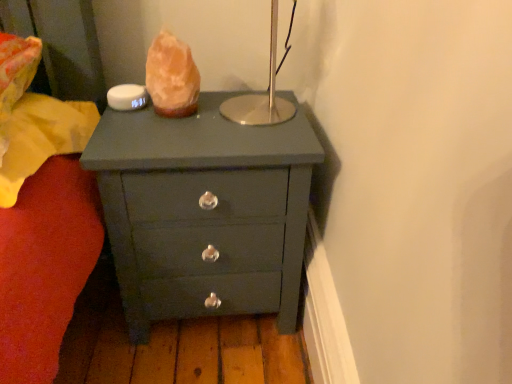
This screenshot has width=512, height=384. I want to click on matte dark green chest of drawers at center, so click(204, 211).

Measure the distance between matte dark green chest of drawers at center and camera.

A distance of 34.17 inches exists between matte dark green chest of drawers at center and camera.

Image resolution: width=512 pixels, height=384 pixels. What do you see at coordinates (204, 211) in the screenshot? I see `matte dark green chest of drawers at center` at bounding box center [204, 211].

Measure the distance between orange crystal at center and camera.

orange crystal at center and camera are 38.68 inches apart from each other.

Measure the distance between point (162, 105) and camera.

3.39 feet.

This screenshot has height=384, width=512. Identify the location of orange crystal at center. (172, 77).

What do you see at coordinates (172, 77) in the screenshot? I see `orange crystal at center` at bounding box center [172, 77].

Where is `matte dark green chest of drawers at center`? This screenshot has height=384, width=512. matte dark green chest of drawers at center is located at coordinates (204, 211).

Which is more to the right, matte dark green chest of drawers at center or orange crystal at center?

From the viewer's perspective, matte dark green chest of drawers at center appears more on the right side.

Based on the photo, which object is closer to the camera, matte dark green chest of drawers at center or orange crystal at center?

matte dark green chest of drawers at center.

Which point is more forward, [274,188] or [188,97]?

Point [274,188]

From the image's perspective, is matte dark green chest of drawers at center beneath orange crystal at center?

Indeed, from the image's perspective, matte dark green chest of drawers at center is shown beneath orange crystal at center.

From a real-world perspective, which is physically below, matte dark green chest of drawers at center or orange crystal at center?

matte dark green chest of drawers at center.

Is matte dark green chest of drawers at center wider or thinner than orange crystal at center?

matte dark green chest of drawers at center is wider than orange crystal at center.

Can you confirm if matte dark green chest of drawers at center is shorter than orange crystal at center?

Incorrect, the height of matte dark green chest of drawers at center does not fall short of that of orange crystal at center.

Looking at the image, does matte dark green chest of drawers at center seem bigger or smaller compared to orange crystal at center?

Clearly, matte dark green chest of drawers at center is larger in size than orange crystal at center.

Is matte dark green chest of drawers at center spatially inside orange crystal at center, or outside of it?

The correct answer is: outside.

Consider the image. Is matte dark green chest of drawers at center far from orange crystal at center?

matte dark green chest of drawers at center is actually quite close to orange crystal at center.

Is matte dark green chest of drawers at center oriented towards orange crystal at center?

No, matte dark green chest of drawers at center is not aimed at orange crystal at center.

The width and height of the screenshot is (512, 384). I want to click on chest of drawers to the right of orange crystal at center, so click(x=204, y=211).

Would you say orange crystal at center is to the left or to the right of matte dark green chest of drawers at center in the picture?

orange crystal at center is to the left of matte dark green chest of drawers at center.

Consider the image. In the image, is orange crystal at center positioned in front of or behind matte dark green chest of drawers at center?

In the image, orange crystal at center appears behind matte dark green chest of drawers at center.

Does point (172, 56) lie in front of point (93, 140)?

No, (172, 56) is behind (93, 140).

From the image's perspective, is orange crystal at center below matte dark green chest of drawers at center?

No, from the image's perspective, orange crystal at center is not beneath matte dark green chest of drawers at center.

In the scene shown: From a real-world perspective, which object stands above the other?

orange crystal at center is physically above.

Considering the sizes of objects orange crystal at center and matte dark green chest of drawers at center in the image provided, who is thinner, orange crystal at center or matte dark green chest of drawers at center?

Thinner between the two is orange crystal at center.

Can you confirm if orange crystal at center is taller than matte dark green chest of drawers at center?

No.

Is orange crystal at center smaller than matte dark green chest of drawers at center?

Yes, orange crystal at center is smaller than matte dark green chest of drawers at center.

Could matte dark green chest of drawers at center be considered to be inside orange crystal at center?

That's incorrect, matte dark green chest of drawers at center is not inside orange crystal at center.

Is orange crystal at center positioned far away from matte dark green chest of drawers at center?

No, there isn't a large distance between orange crystal at center and matte dark green chest of drawers at center.

Is orange crystal at center facing away from matte dark green chest of drawers at center?

No, orange crystal at center's orientation is not away from matte dark green chest of drawers at center.

Locate an element on the screen. food that is above the matte dark green chest of drawers at center (from a real-world perspective) is located at coordinates (172, 77).

At what (x,y) coordinates should I click in order to perform the action: click on food located behind the matte dark green chest of drawers at center. Please return your answer as a coordinate pair (x, y). Looking at the image, I should click on (172, 77).

Where is `chest of drawers in front of the orange crystal at center`? This screenshot has height=384, width=512. chest of drawers in front of the orange crystal at center is located at coordinates (204, 211).